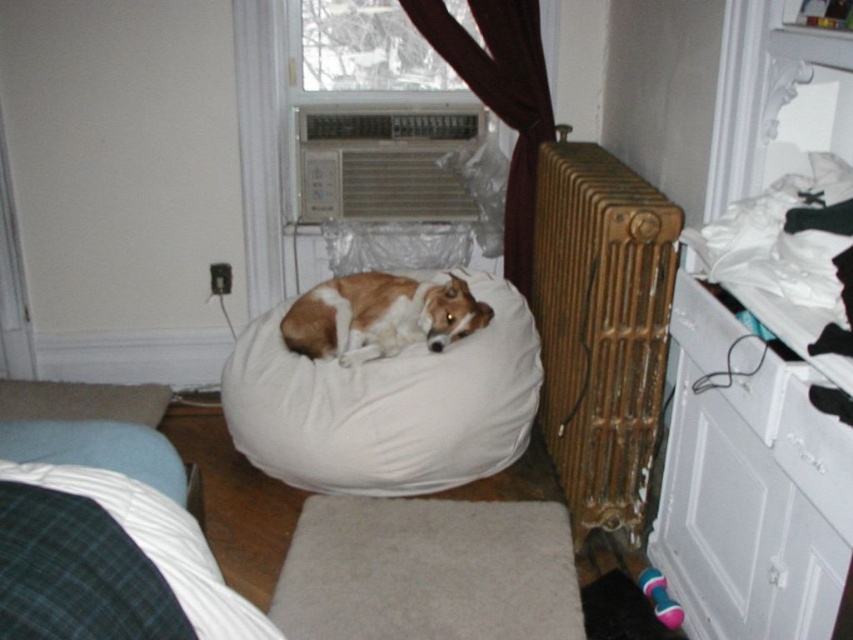
You are a pet sitter who needs to clean the area around the brown and white fur at center and the white glossy drawer at right. Which object requires more space to clean around it?

The brown and white fur at center requires more space to clean around it because it is bigger than the white glossy drawer at right.

You are a delivery person entering the room and need to place a package on the floor near the brown and white fur at center. Based on the coordinates provided, where exactly should you place the package?

The coordinates for the brown and white fur at center are at point (380, 316), so you should place the package near that location.